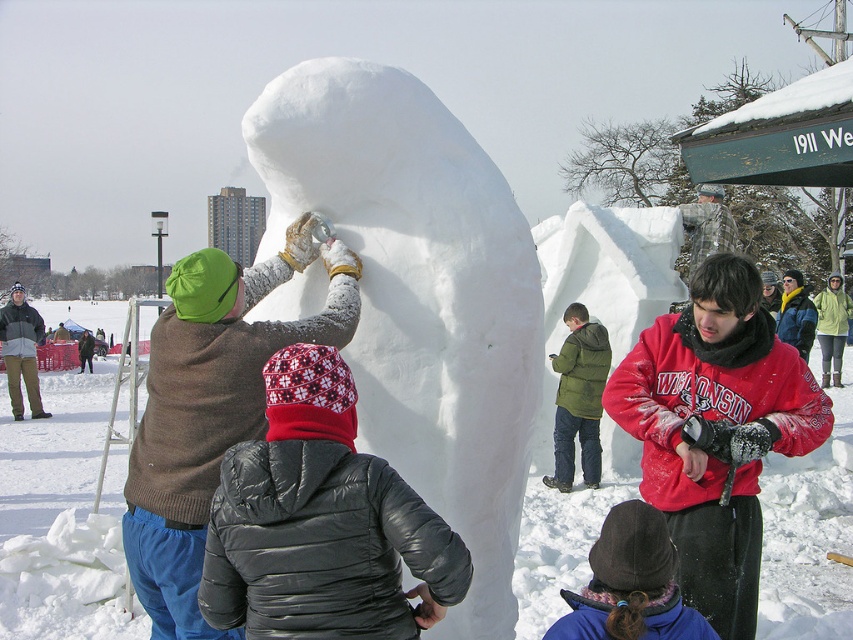
You are standing at point (x=177, y=522) and want to walk towards point (x=502, y=180). Which direction should you move relative to your current position?

You should move backward because point (x=502, y=180) is behind point (x=177, y=522) relative to your current position.

You are a photographer trying to capture a photo of both the brown wool sweater at upper left and the green puffy jacket at center. Since you want both subjects to be fully visible in the frame, which one should you focus on to ensure the shorter one isn

The brown wool sweater at upper left is shorter than the green puffy jacket at center. To ensure both are fully visible, focus on the shorter one, which is the brown wool sweater at upper left, so the camera can capture the taller green puffy jacket at center without cropping it.